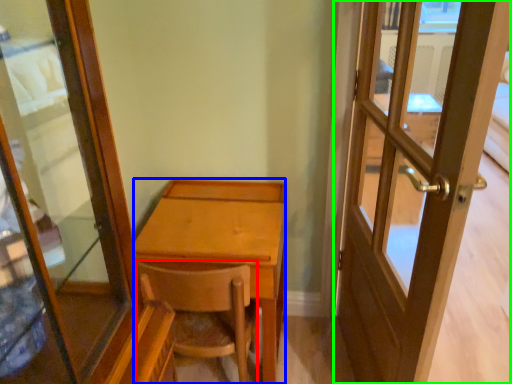
Question: Considering the real-world distances, which object is farthest from chair (highlighted by a red box)? desk (highlighted by a blue box) or door (highlighted by a green box)?

Choices:
 (A) desk
 (B) door

Answer: (B)